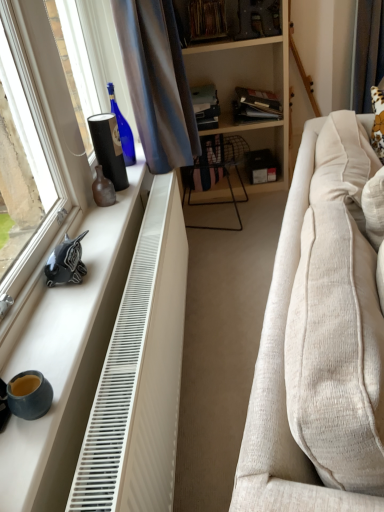
Question: Is matte blue coffee cup at lower left not inside hardcover book at center, which appears as the 1th book when viewed from the left?

Choices:
 (A) no
 (B) yes

Answer: (B)

Question: Is matte blue coffee cup at lower left looking in the opposite direction of hardcover book at center, which is counted as the 3th book, starting from the right?

Choices:
 (A) yes
 (B) no

Answer: (B)

Question: Does matte blue coffee cup at lower left have a greater width compared to hardcover book at center, which appears as the 1th book when viewed from the left?

Choices:
 (A) yes
 (B) no

Answer: (B)

Question: Is hardcover book at center, which is counted as the 3th book, starting from the right, surrounded by matte blue coffee cup at lower left?

Choices:
 (A) no
 (B) yes

Answer: (A)

Question: Considering the relative sizes of matte blue coffee cup at lower left and hardcover book at center, which appears as the 1th book when viewed from the left, in the image provided, is matte blue coffee cup at lower left bigger than hardcover book at center, which appears as the 1th book when viewed from the left,?

Choices:
 (A) yes
 (B) no

Answer: (B)

Question: From a real-world perspective, is satin blue curtain at upper left, which ranks as the 1th curtain in left-to-right order, physically located above or below hardcover book at center, which is counted as the 3th book, starting from the right?

Choices:
 (A) above
 (B) below

Answer: (A)

Question: Considering the positions of satin blue curtain at upper left, which is the first curtain in front-to-back order, and hardcover book at center, which appears as the 1th book when viewed from the left, in the image, is satin blue curtain at upper left, which is the first curtain in front-to-back order, taller or shorter than hardcover book at center, which appears as the 1th book when viewed from the left,?

Choices:
 (A) short
 (B) tall

Answer: (B)

Question: In terms of width, does satin blue curtain at upper left, which is the first curtain in front-to-back order, look wider or thinner when compared to hardcover book at center, which is counted as the 3th book, starting from the right?

Choices:
 (A) wide
 (B) thin

Answer: (B)

Question: Looking at the image, does satin blue curtain at upper left, which is the 2th curtain from back to front, seem bigger or smaller compared to hardcover book at center, which is counted as the 3th book, starting from the right?

Choices:
 (A) small
 (B) big

Answer: (B)

Question: From a real-world perspective, is white plastic radiator at lower left physically located above or below brown fabric curtain at upper right, which is the second curtain from left to right?

Choices:
 (A) below
 (B) above

Answer: (A)

Question: Considering the positions of white plastic radiator at lower left and brown fabric curtain at upper right, acting as the second curtain starting from the front, in the image, is white plastic radiator at lower left wider or thinner than brown fabric curtain at upper right, acting as the second curtain starting from the front,?

Choices:
 (A) thin
 (B) wide

Answer: (A)

Question: Considering their positions, is white plastic radiator at lower left located in front of or behind brown fabric curtain at upper right, acting as the second curtain starting from the front?

Choices:
 (A) behind
 (B) front

Answer: (B)

Question: From the image's perspective, is white plastic radiator at lower left above or below brown fabric curtain at upper right, which is the second curtain from left to right?

Choices:
 (A) below
 (B) above

Answer: (A)

Question: In terms of height, does brown fabric curtain at upper right, which is the 1th curtain in right-to-left order, look taller or shorter compared to satin blue curtain at upper left, which ranks as the 1th curtain in left-to-right order?

Choices:
 (A) tall
 (B) short

Answer: (A)

Question: Is point (370, 28) closer or farther from the camera than point (183, 98)?

Choices:
 (A) closer
 (B) farther

Answer: (B)